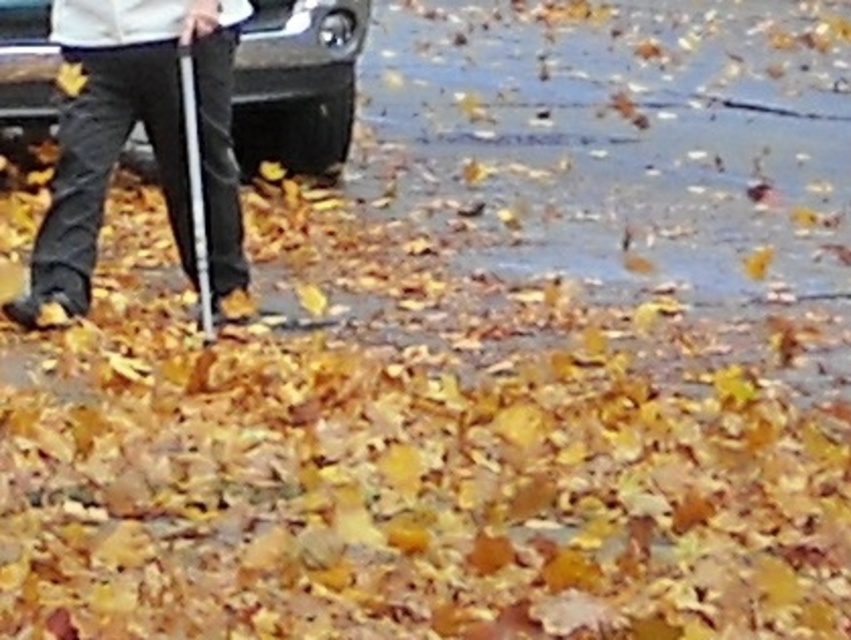
Measure the distance between black matte car at center and camera.

black matte car at center is 8.22 meters away from camera.

Between black matte car at center and metallic silver crutch at left, which one has less height?

black matte car at center is shorter.

Which is behind, point (323, 51) or point (197, 141)?

Positioned behind is point (323, 51).

Identify the location of black matte car at center. [x=297, y=83].

Is dark gray pants at left smaller than metallic silver crutch at left?

Actually, dark gray pants at left might be larger than metallic silver crutch at left.

Between point (218, 4) and point (201, 320), which one is positioned in front?

Point (218, 4) is in front.

Is point (109, 52) in front of point (206, 248)?

Yes.

Where is `dark gray pants at left`? This screenshot has width=851, height=640. dark gray pants at left is located at coordinates (146, 132).

Is dark gray pants at left below black matte car at center?

Indeed, dark gray pants at left is positioned under black matte car at center.

Does dark gray pants at left have a smaller size compared to black matte car at center?

Correct, dark gray pants at left occupies less space than black matte car at center.

Identify the location of dark gray pants at left. Image resolution: width=851 pixels, height=640 pixels. (146, 132).

Where is `dark gray pants at left`? This screenshot has width=851, height=640. dark gray pants at left is located at coordinates (146, 132).